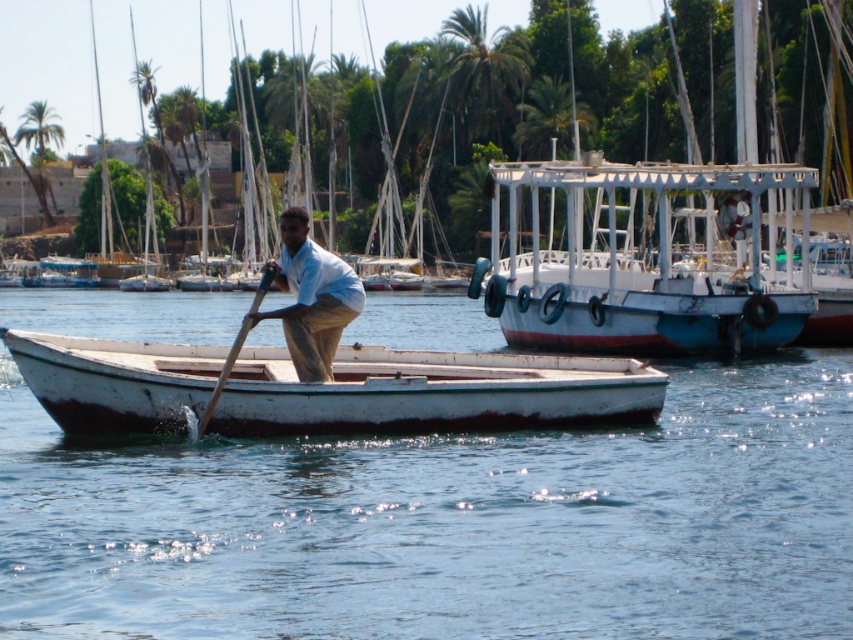
Question: Is green leafy palm tree at upper center closer to the viewer compared to wooden at left?

Choices:
 (A) no
 (B) yes

Answer: (A)

Question: Is white matte canoe at center positioned in front of light beige cotton shirt at center?

Choices:
 (A) no
 (B) yes

Answer: (B)

Question: Among these points, which one is farthest from the camera?

Choices:
 (A) (438, 420)
 (B) (332, 284)
 (C) (456, 35)
 (D) (640, 163)

Answer: (C)

Question: Based on their relative distances, which object is farther from the clear blue water at center?

Choices:
 (A) green leafy palm tree at upper center
 (B) green leafy palm tree at upper left
 (C) white matte canoe at center

Answer: (B)

Question: Among these objects, which one is nearest to the camera?

Choices:
 (A) white wooden boat at upper right
 (B) light beige cotton shirt at center

Answer: (B)

Question: Is the position of white wooden boat at upper right less distant than that of green leafy palm tree at upper left?

Choices:
 (A) no
 (B) yes

Answer: (B)